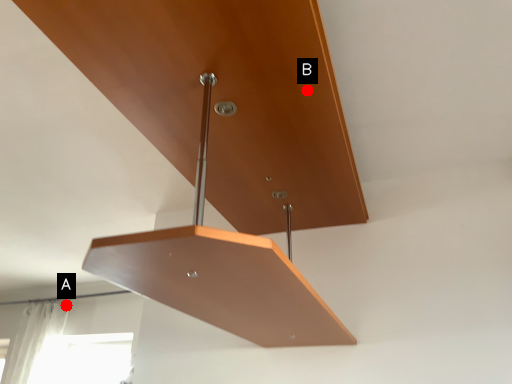
Question: Two points are circled on the image, labeled by A and B beside each circle. Which point appears closest to the camera in this image?

Choices:
 (A) A is closer
 (B) B is closer

Answer: (B)